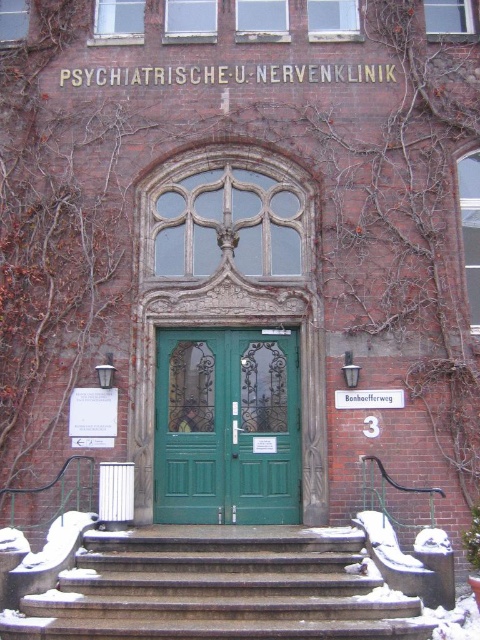
You are standing at the entrance of the Psychiatric and Neurological Clinic. You need to locate the dark gray stone stairs at center. According to the coordinates provided, where exactly are they positioned?

The dark gray stone stairs at center are positioned at coordinates point (218, 588).

You are a wheelchair user approaching the entrance of the Psychiatric and Neurological Clinic. You need to reach the green painted wood door at center. Are the dark gray stone stairs at center an obstacle in your path?

The dark gray stone stairs at center are closer to the viewer than the green painted wood door at center, so they are in the way and would block access to the door without going around them.